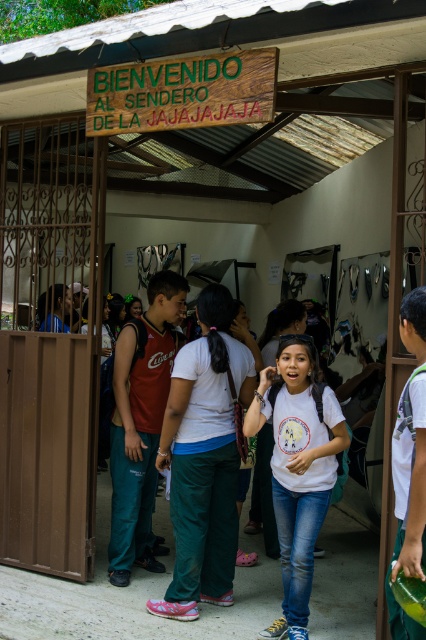
Is point (290, 637) positioned in front of point (157, 397)?

That is True.

Who is positioned more to the left, white matte shirt at center or matte red tank top at center?

From the viewer's perspective, matte red tank top at center appears more on the left side.

Is point (298, 529) positioned before point (163, 301)?

That is True.

Where is `white matte shirt at center`? The width and height of the screenshot is (426, 640). white matte shirt at center is located at coordinates (298, 468).